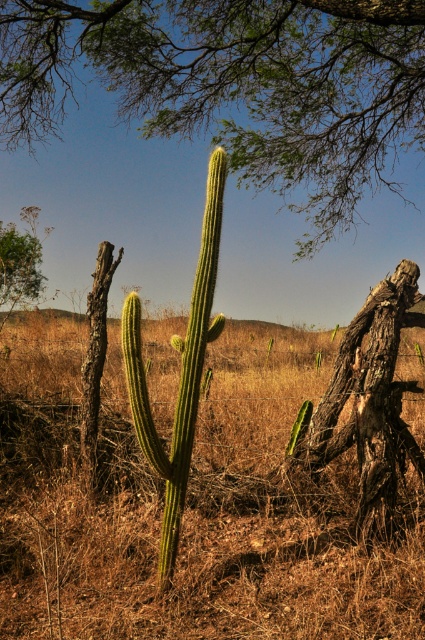
You are an environmental scientist studying desert vegetation. You observe the green leafy tree at upper center and the rough bark tree trunk at right in the image. Which of these two trees has a smaller diameter?

The green leafy tree at upper center has a smaller diameter than the rough bark tree trunk at right.

You are a hiker trying to cross this desert landscape. You need to step over the green dry grass at center and the rough bark tree trunk at right. Which one has a wider base that you need to step over?

The green dry grass at center has a wider base than the rough bark tree trunk at right, so you need to step over its wider base.